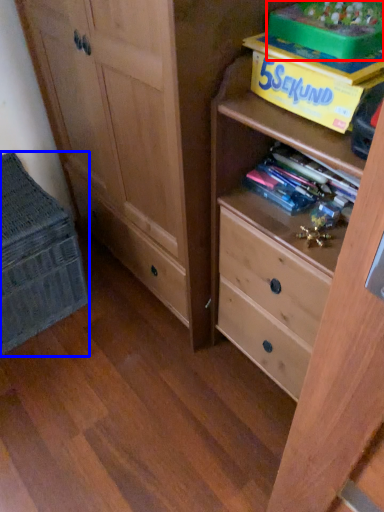
Question: Which of the following is the closest to the observer, storage box (highlighted by a red box) or cabinetry (highlighted by a blue box)?

Choices:
 (A) storage box
 (B) cabinetry

Answer: (A)